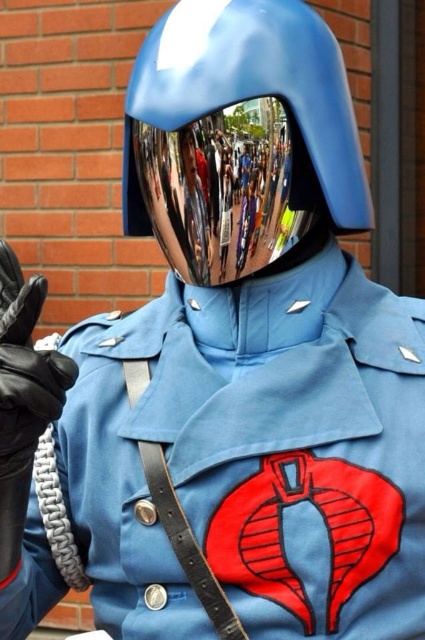
Question: Is the position of shiny metallic helmet at center less distant than that of black leather glove at lower left?

Choices:
 (A) yes
 (B) no

Answer: (B)

Question: Does shiny metallic helmet at center appear under black leather glove at lower left?

Choices:
 (A) yes
 (B) no

Answer: (B)

Question: Which point appears closest to the camera in this image?

Choices:
 (A) (320, 173)
 (B) (40, 356)

Answer: (B)

Question: Considering the relative positions of shiny metallic helmet at center and black leather glove at lower left in the image provided, where is shiny metallic helmet at center located with respect to black leather glove at lower left?

Choices:
 (A) below
 (B) above

Answer: (B)

Question: Among these points, which one is nearest to the camera?

Choices:
 (A) (237, 52)
 (B) (19, 412)

Answer: (B)